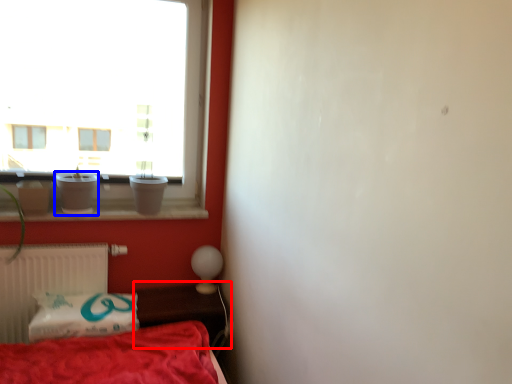
Question: Which point is further to the camera, table (highlighted by a red box) or glass vase (highlighted by a blue box)?

Choices:
 (A) table
 (B) glass vase

Answer: (B)